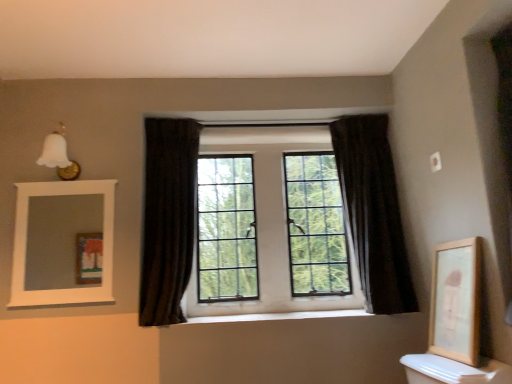
Question: Is wooden framed artwork at right in front of white wooden mirror at upper left?

Choices:
 (A) no
 (B) yes

Answer: (B)

Question: Considering the relative positions of wooden framed artwork at right and white wooden mirror at upper left in the image provided, is wooden framed artwork at right to the right of white wooden mirror at upper left from the viewer's perspective?

Choices:
 (A) no
 (B) yes

Answer: (B)

Question: From the image's perspective, is wooden framed artwork at right on top of white wooden mirror at upper left?

Choices:
 (A) no
 (B) yes

Answer: (A)

Question: Does wooden framed artwork at right have a larger size compared to white wooden mirror at upper left?

Choices:
 (A) yes
 (B) no

Answer: (A)

Question: Are wooden framed artwork at right and white wooden mirror at upper left located far from each other?

Choices:
 (A) yes
 (B) no

Answer: (A)

Question: Can you confirm if wooden framed artwork at right is wider than white wooden mirror at upper left?

Choices:
 (A) yes
 (B) no

Answer: (A)

Question: Can you confirm if wooden framed artwork at right is taller than dark velvet curtain at center, acting as the first curtain starting from the left?

Choices:
 (A) yes
 (B) no

Answer: (B)

Question: Can you confirm if wooden framed artwork at right is smaller than dark velvet curtain at center, positioned as the 2th curtain in right-to-left order?

Choices:
 (A) no
 (B) yes

Answer: (B)

Question: Is wooden framed artwork at right facing towards dark velvet curtain at center, positioned as the 2th curtain in right-to-left order?

Choices:
 (A) yes
 (B) no

Answer: (A)

Question: Are wooden framed artwork at right and dark velvet curtain at center, acting as the first curtain starting from the left, located far from each other?

Choices:
 (A) no
 (B) yes

Answer: (B)

Question: From a real-world perspective, is wooden framed artwork at right located higher than dark velvet curtain at center, positioned as the 2th curtain in right-to-left order?

Choices:
 (A) yes
 (B) no

Answer: (B)

Question: Is dark velvet curtain at center, positioned as the 2th curtain in right-to-left order, at the back of wooden framed artwork at right?

Choices:
 (A) no
 (B) yes

Answer: (A)

Question: Would you say dark fabric curtain at center, the 2th curtain positioned from the left, contains wooden framed artwork at right?

Choices:
 (A) yes
 (B) no

Answer: (B)